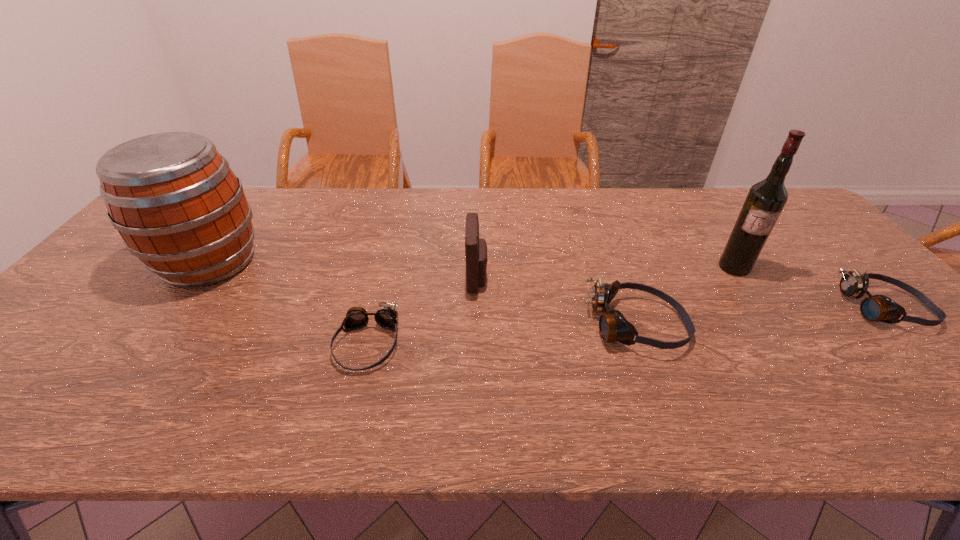
Locate an element on the screen. This screenshot has height=540, width=960. blank region between the second goggles from right to left and the fourth object from right to left is located at coordinates (557, 302).

Find the location of a particular element. This screenshot has width=960, height=540. unoccupied position between the shortest object and the fourth object from right to left is located at coordinates (422, 311).

This screenshot has height=540, width=960. Find the location of `free space between the fifth shortest object and the second tallest goggles`. free space between the fifth shortest object and the second tallest goggles is located at coordinates (548, 285).

Image resolution: width=960 pixels, height=540 pixels. Find the location of `vacant area that lies between the third tallest object and the leftmost goggles`. vacant area that lies between the third tallest object and the leftmost goggles is located at coordinates (422, 311).

Identify the location of free space between the third object from right to left and the third tallest object. [557, 302].

At what (x,y) coordinates should I click in order to perform the action: click on empty space between the fifth tallest object and the fourth shortest object. Please return your answer as a coordinate pair (x, y). Image resolution: width=960 pixels, height=540 pixels. Looking at the image, I should click on (682, 293).

Locate an element on the screen. This screenshot has height=540, width=960. free area in between the fourth object from left to right and the cider is located at coordinates (423, 294).

At what (x,y) coordinates should I click in order to perform the action: click on free point between the leftmost goggles and the fifth object from left to right. Please return your answer as a coordinate pair (x, y). The width and height of the screenshot is (960, 540). Looking at the image, I should click on (550, 306).

The width and height of the screenshot is (960, 540). What are the coordinates of `blank region between the second tallest object and the leftmost goggles` in the screenshot? It's located at (288, 303).

Identify which object is the fifth closest to the rightmost goggles. Please provide its 2D coordinates. Your answer should be formatted as a tuple, i.e. [(x, y)], where the tuple contains the x and y coordinates of a point satisfying the conditions above.

[(178, 206)]